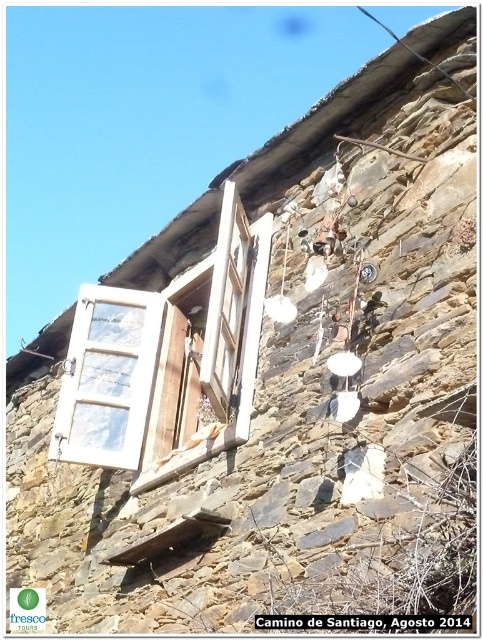
Question: Is white plastic window at upper left smaller than white wood window at center?

Choices:
 (A) yes
 (B) no

Answer: (B)

Question: Which point is closer to the camera taking this photo?

Choices:
 (A) (103, 436)
 (B) (259, 221)

Answer: (B)

Question: Which object appears closest to the camera in this image?

Choices:
 (A) white wood window at center
 (B) white plastic window at upper left

Answer: (A)

Question: Observing the image, what is the correct spatial positioning of white plastic window at upper left in reference to white wood window at center?

Choices:
 (A) above
 (B) below

Answer: (B)

Question: Is white plastic window at upper left to the right of white wood window at center from the viewer's perspective?

Choices:
 (A) no
 (B) yes

Answer: (A)